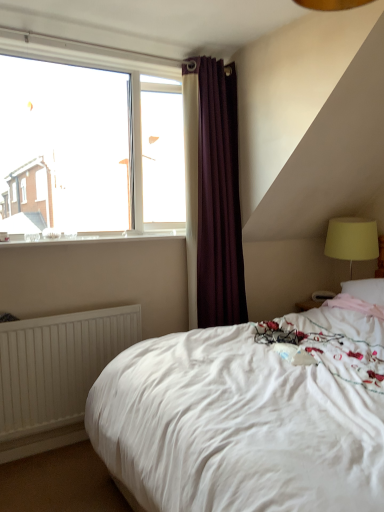
Question: Is white glossy window sill at upper left far from clear glass window at upper left?

Choices:
 (A) no
 (B) yes

Answer: (A)

Question: From a real-world perspective, is white glossy window sill at upper left on top of clear glass window at upper left?

Choices:
 (A) no
 (B) yes

Answer: (A)

Question: Would you say white glossy window sill at upper left is outside clear glass window at upper left?

Choices:
 (A) yes
 (B) no

Answer: (A)

Question: Is white glossy window sill at upper left looking in the opposite direction of clear glass window at upper left?

Choices:
 (A) no
 (B) yes

Answer: (A)

Question: Is the position of white glossy window sill at upper left more distant than that of clear glass window at upper left?

Choices:
 (A) no
 (B) yes

Answer: (A)

Question: Considering the relative sizes of white glossy window sill at upper left and clear glass window at upper left in the image provided, is white glossy window sill at upper left taller than clear glass window at upper left?

Choices:
 (A) yes
 (B) no

Answer: (B)

Question: From the image's perspective, is dark purple velvet curtain at upper center located beneath white soft bed at center?

Choices:
 (A) yes
 (B) no

Answer: (B)

Question: Would you consider dark purple velvet curtain at upper center to be distant from white soft bed at center?

Choices:
 (A) no
 (B) yes

Answer: (B)

Question: Is white soft bed at center a part of dark purple velvet curtain at upper center?

Choices:
 (A) no
 (B) yes

Answer: (A)

Question: From a real-world perspective, is dark purple velvet curtain at upper center beneath white soft bed at center?

Choices:
 (A) yes
 (B) no

Answer: (B)

Question: Is dark purple velvet curtain at upper center taller than white soft bed at center?

Choices:
 (A) yes
 (B) no

Answer: (A)

Question: Are dark purple velvet curtain at upper center and white soft bed at center beside each other?

Choices:
 (A) no
 (B) yes

Answer: (A)

Question: Is white glossy window sill at upper left not near white matte radiator at lower left?

Choices:
 (A) no
 (B) yes

Answer: (A)